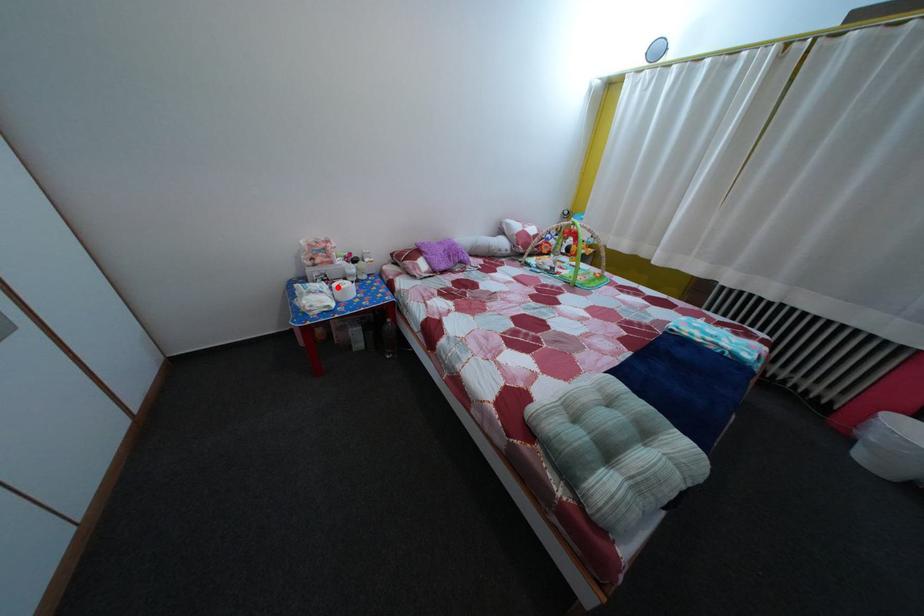
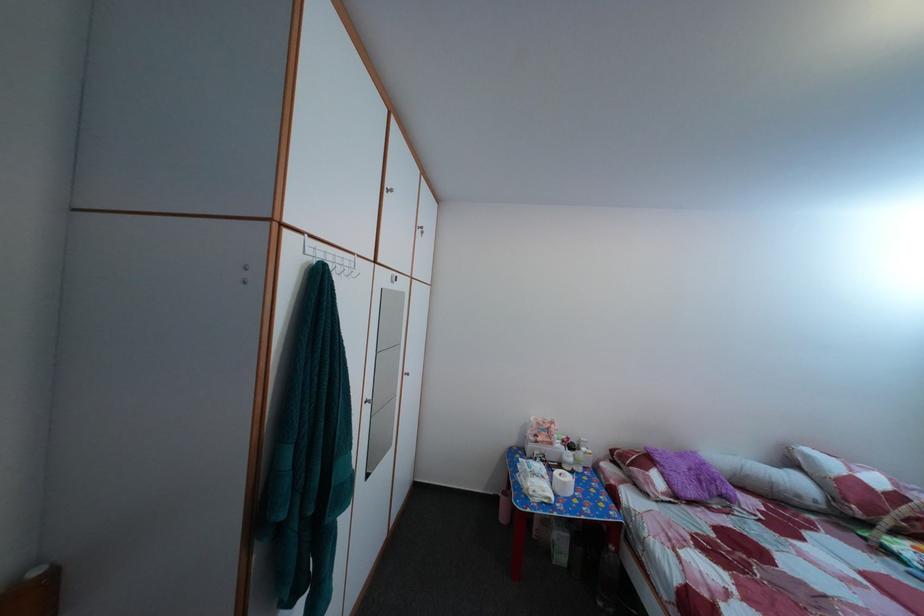
In the second image, find the point that corresponds to the highlighted location in the first image.

(555, 469)